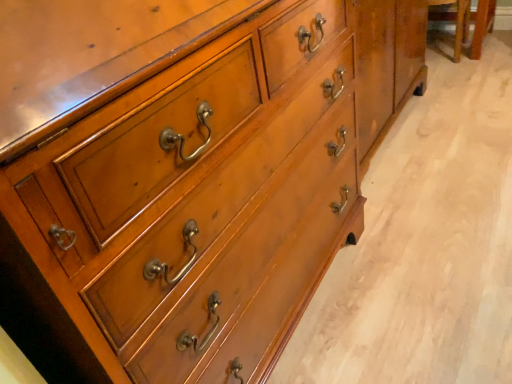
The width and height of the screenshot is (512, 384). Identify the location of glossy wood vanity at upper right. (467, 23).

The image size is (512, 384). Describe the element at coordinates (467, 23) in the screenshot. I see `glossy wood vanity at upper right` at that location.

What is the approximate width of glossy wood vanity at upper right?

The width of glossy wood vanity at upper right is 19.04 inches.

The image size is (512, 384). Identify the location of glossy wood vanity at upper right. (467, 23).